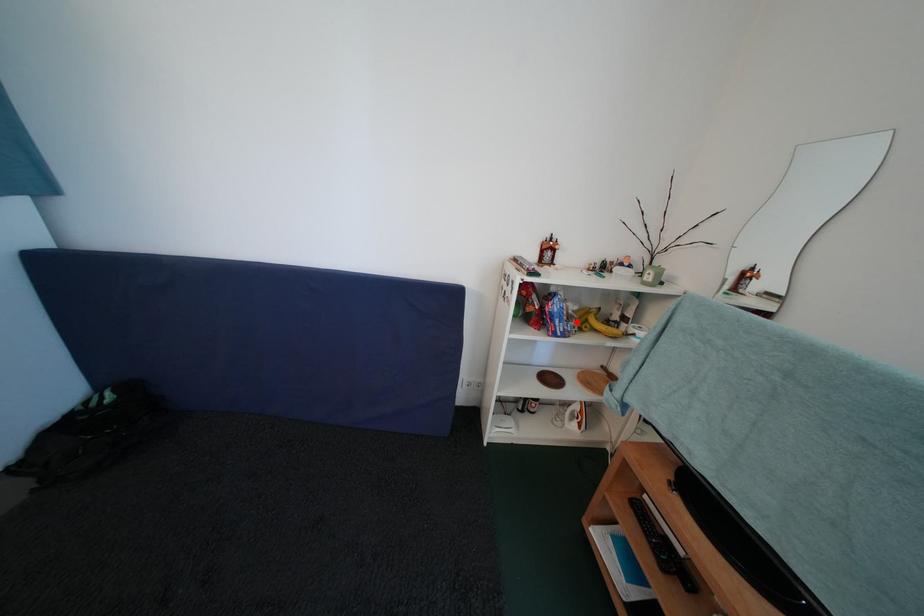
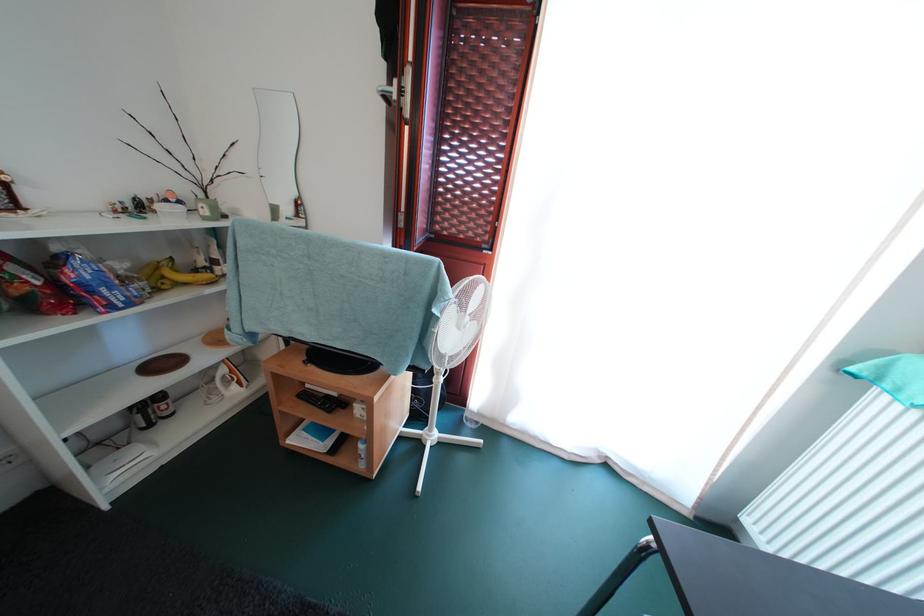
Where in the second image is the point corresponding to the highlighted location from the first image?

(131, 285)